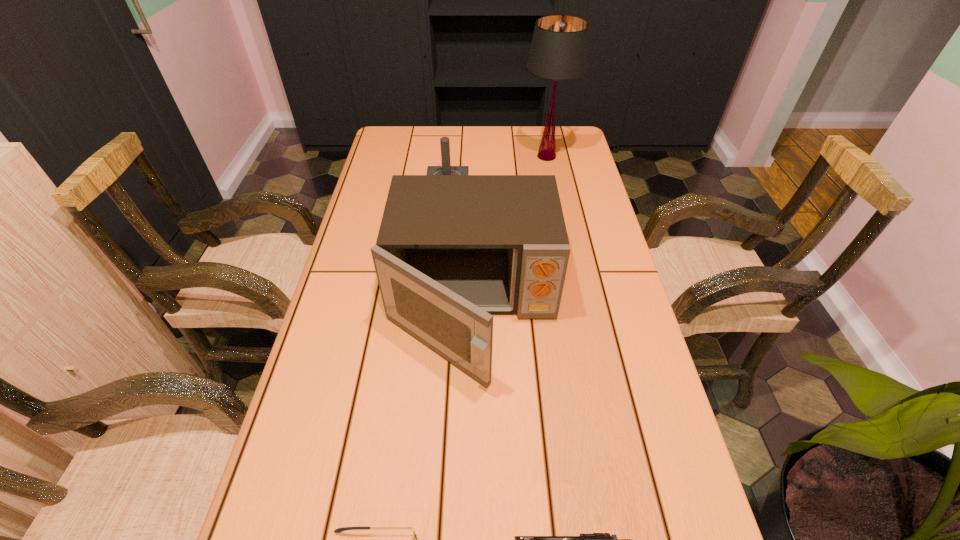
Image resolution: width=960 pixels, height=540 pixels. Identify the location of blank space located 0.140m on the rectangular base of the joystick. (512, 191).

Where is `object at the far edge`? The height and width of the screenshot is (540, 960). object at the far edge is located at coordinates point(559,50).

Image resolution: width=960 pixels, height=540 pixels. What are the coordinates of `object situated at the left edge` in the screenshot? It's located at (451, 250).

You are a GUI agent. You are given a task and a screenshot of the screen. Output one action in this format:
    pyautogui.click(x=<x>, y=<y>)
    Task: Click on the object at the right edge
    This screenshot has height=540, width=960.
    Given the screenshot: What is the action you would take?
    (x=559, y=50)

Identify the location of object present at the far right corner. (559, 50).

In the image, there is a desktop. Identify the location of vacant space at the far edge. This screenshot has height=540, width=960. (484, 142).

Find the location of a particular element. Image resolution: width=960 pixels, height=540 pixels. vacant space at the left edge of the desktop is located at coordinates (373, 271).

The height and width of the screenshot is (540, 960). Find the location of `vacant space at the right edge of the desktop`. vacant space at the right edge of the desktop is located at coordinates (560, 191).

Choose which object is the second nearest neighbor to the sunglasses. Please provide its 2D coordinates. Your answer should be formatted as a tuple, i.e. [(x, y)], where the tuple contains the x and y coordinates of a point satisfying the conditions above.

[(451, 250)]

In order to click on object identified as the third closest to the sunglasses in this screenshot , I will do `click(446, 169)`.